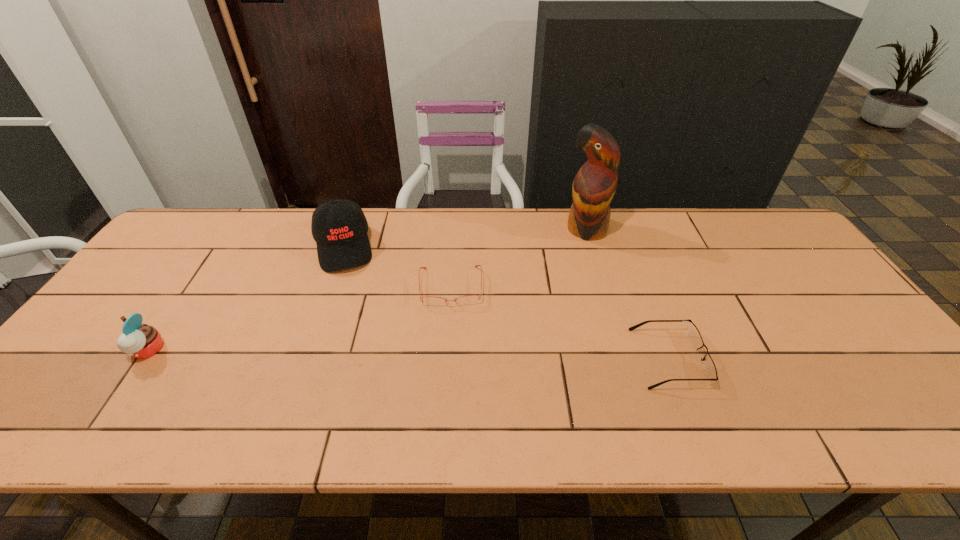
I want to click on the third closest object to the leftmost object, so click(594, 185).

The image size is (960, 540). In order to click on object that can be found as the second closest to the parrot in this screenshot , I will do `click(709, 367)`.

Where is `free space that satisfies the following two spatial constraints: 1. on the front side of the nearer spectacles; 2. on the front-facing side of the tallest object`? free space that satisfies the following two spatial constraints: 1. on the front side of the nearer spectacles; 2. on the front-facing side of the tallest object is located at coordinates (624, 359).